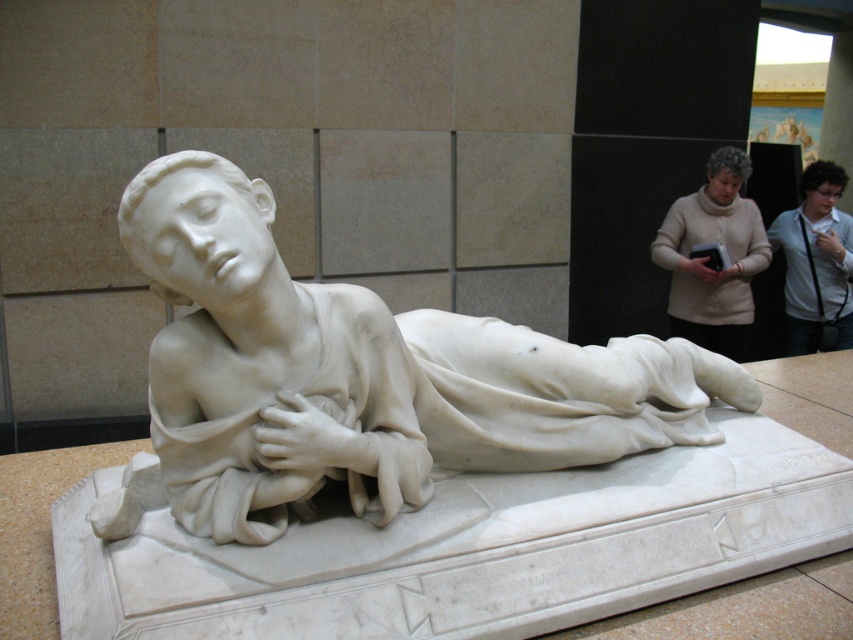
Who is taller, white marble statue at center or white shirt at upper right?

With more height is white shirt at upper right.

Between white marble statue at center and white shirt at upper right, which one appears on the left side from the viewer's perspective?

Positioned to the left is white marble statue at center.

Which is in front, point (306, 365) or point (813, 170)?

Point (306, 365)

Image resolution: width=853 pixels, height=640 pixels. What are the coordinates of `white marble statue at center` in the screenshot? It's located at (364, 374).

In the scene shown: Between white marble statue at center and beige sweater at upper right, which one appears on the right side from the viewer's perspective?

beige sweater at upper right

Is the position of white marble statue at center more distant than that of beige sweater at upper right?

No, white marble statue at center is closer to the viewer.

Identify the location of white marble statue at center. (364, 374).

What are the coordinates of `white marble statue at center` in the screenshot? It's located at (364, 374).

Who is shorter, beige sweater at upper right or white shirt at upper right?

With less height is beige sweater at upper right.

Who is more distant from viewer, (711,332) or (817,264)?

Point (817,264)

Where is `beige sweater at upper right`? beige sweater at upper right is located at coordinates (705, 259).